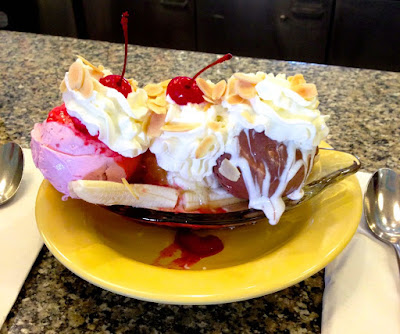
I want to click on table, so click(x=203, y=322).